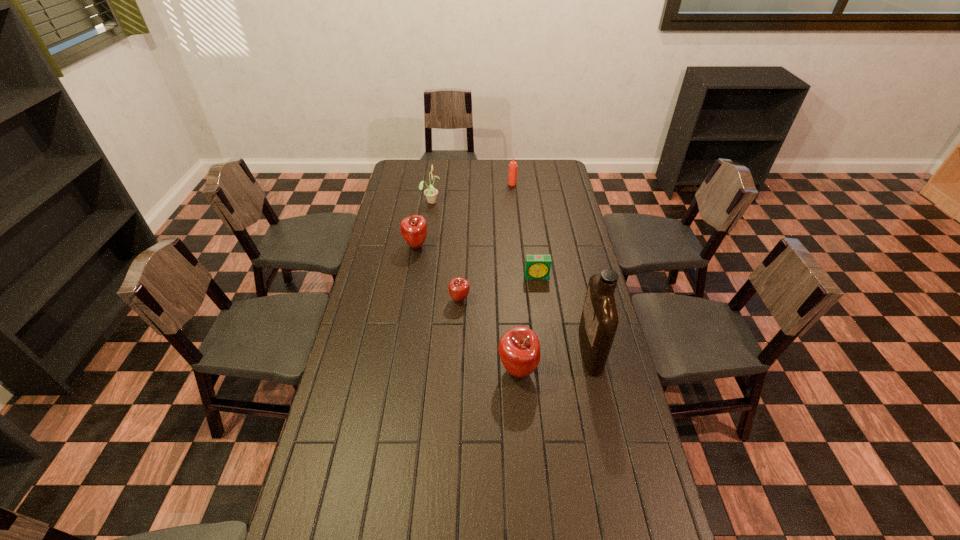
Find the location of a particular element. the fifth nearest object is located at coordinates (413, 228).

I want to click on the second tallest apple, so click(x=413, y=228).

Image resolution: width=960 pixels, height=540 pixels. Identify the location of the fifth object from right to left. (459, 287).

What are the coordinates of `the fifth farthest object` in the screenshot? It's located at (459, 287).

The image size is (960, 540). I want to click on the rightmost apple, so point(519,348).

Image resolution: width=960 pixels, height=540 pixels. Identify the location of the second farthest object. (430, 193).

Identify the location of Tabasco sauce. The image size is (960, 540). (512, 176).

Where is `the fourth farthest object`? The width and height of the screenshot is (960, 540). the fourth farthest object is located at coordinates (536, 266).

Image resolution: width=960 pixels, height=540 pixels. I want to click on liquor, so tap(599, 320).

At what (x,y) coordinates should I click in order to perform the action: click on the tallest object. Please return your answer as a coordinate pair (x, y). This screenshot has width=960, height=540. Looking at the image, I should click on (599, 320).